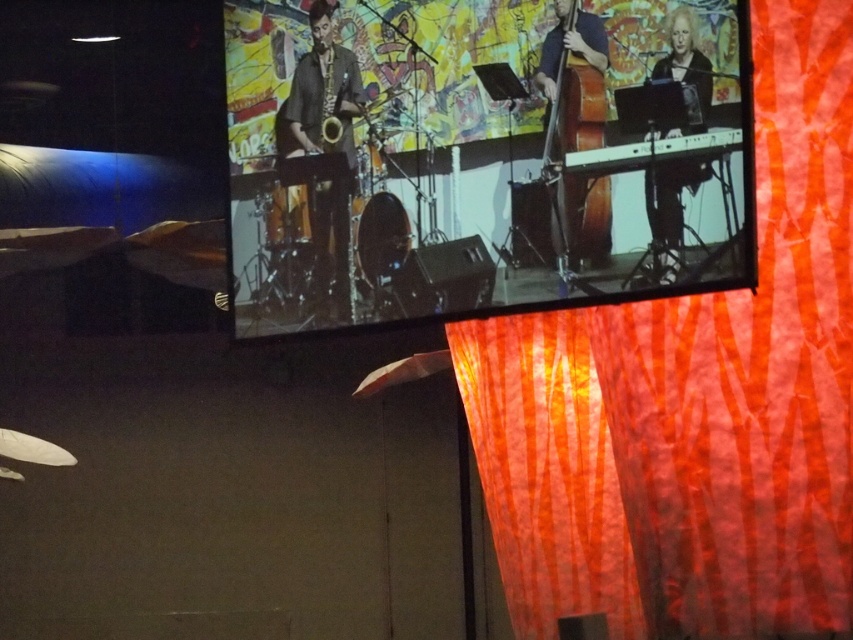
Question: Which of the following is the farthest from the observer?

Choices:
 (A) (563, 216)
 (B) (502, 74)

Answer: (B)

Question: Is matte black keyboard at right thinner than matte gold saxophone at center?

Choices:
 (A) yes
 (B) no

Answer: (B)

Question: Is orange striped fabric at right smaller than shiny gold saxophone at center?

Choices:
 (A) no
 (B) yes

Answer: (A)

Question: Which object appears farthest from the camera in this image?

Choices:
 (A) matte gold saxophone at center
 (B) matte black keyboard at right
 (C) shiny gold saxophone at center
 (D) brown wooden double bass at center

Answer: (A)

Question: Which object is positioned closest to the matte gold saxophone at center?

Choices:
 (A) shiny gold saxophone at center
 (B) matte black keyboard at right

Answer: (A)

Question: In this image, where is shiny gold saxophone at center located relative to matte black keyboard at right?

Choices:
 (A) below
 (B) above

Answer: (B)